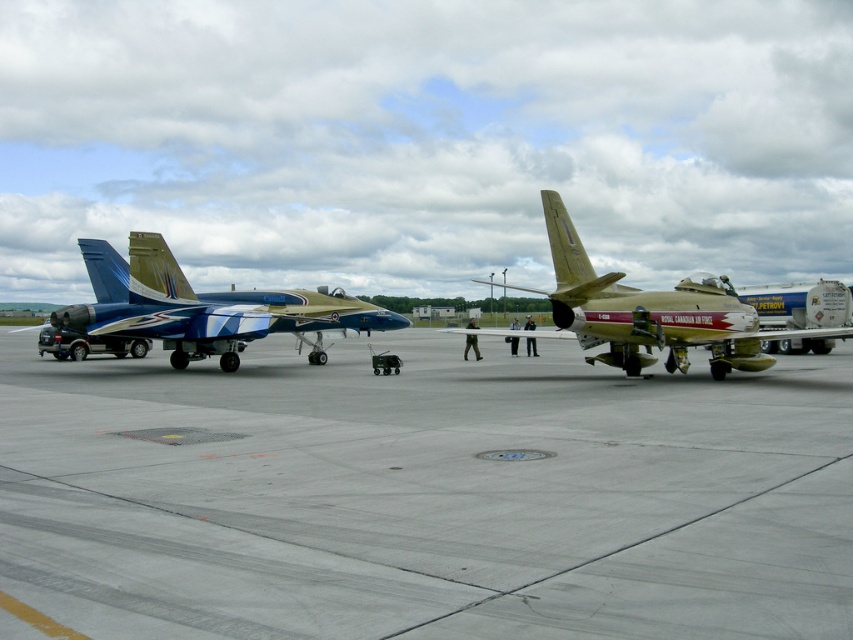
Can you confirm if shiny blue and white fighter jet at center is shorter than matte gold airplane at center?

Correct, shiny blue and white fighter jet at center is not as tall as matte gold airplane at center.

Can you confirm if shiny blue and white fighter jet at center is positioned above matte gold airplane at center?

Incorrect, shiny blue and white fighter jet at center is not positioned above matte gold airplane at center.

Which is in front, point (256, 326) or point (627, 320)?

Point (627, 320)

Locate an element on the screen. shiny blue and white fighter jet at center is located at coordinates (200, 305).

Locate an element on the screen. gray concrete tarmac at center is located at coordinates (426, 493).

What do you see at coordinates (426, 493) in the screenshot? Image resolution: width=853 pixels, height=640 pixels. I see `gray concrete tarmac at center` at bounding box center [426, 493].

At what (x,y) coordinates should I click in order to perform the action: click on gray concrete tarmac at center. Please return your answer as a coordinate pair (x, y). Looking at the image, I should click on (426, 493).

Where is `gray concrete tarmac at center`? gray concrete tarmac at center is located at coordinates (426, 493).

Is point (614, 444) more distant than point (231, 296)?

That is False.

Does gray concrete tarmac at center appear over shiny blue and white fighter jet at center?

Incorrect, gray concrete tarmac at center is not positioned above shiny blue and white fighter jet at center.

Which is behind, point (164, 545) or point (399, 316)?

The point (399, 316) is behind.

At what (x,y) coordinates should I click in order to perform the action: click on gray concrete tarmac at center. Please return your answer as a coordinate pair (x, y). This screenshot has height=640, width=853. Looking at the image, I should click on (426, 493).